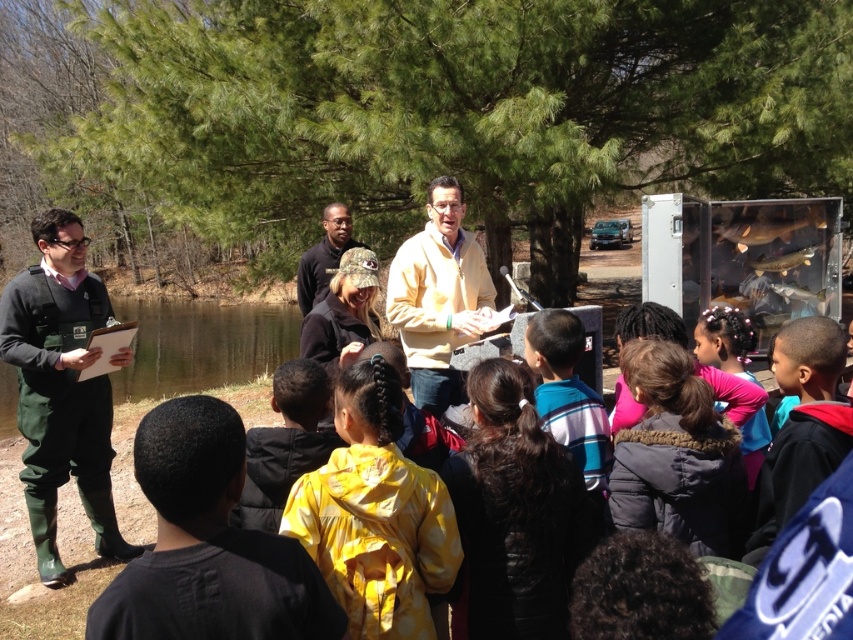
You are a photographer trying to capture both the yellow polka dot jacket at center and the camouflage fabric cap at center in the same frame. Which object will appear larger in the photo?

The yellow polka dot jacket at center will appear larger in the photo because it is much taller than the camouflage fabric cap at center.

You are standing at the center of the outdoor educational event scene. You see a point labeled as point (201, 346). What does this point indicate?

The point (201, 346) indicates green matte water at left.

You are a photographer standing at the back of the group. You want to take a photo that includes both the yellow polka dot jacket at center and the green uniform at left. What is the minimum distance you need to move backward to ensure both subjects are fully in frame?

To include both the yellow polka dot jacket at center and the green uniform at left, you need to move back at least 3.02 meters so that the distance between them is fully captured in the frame.